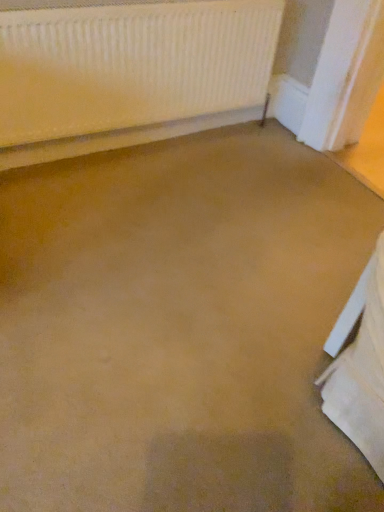
The image size is (384, 512). What do you see at coordinates (134, 65) in the screenshot? I see `white textured radiator at upper left` at bounding box center [134, 65].

Measure the distance between white textured radiator at upper left and camera.

They are 4.92 feet apart.

Locate an element on the screen. white textured radiator at upper left is located at coordinates (134, 65).

Where is `white textured radiator at upper left`? Image resolution: width=384 pixels, height=512 pixels. white textured radiator at upper left is located at coordinates (134, 65).